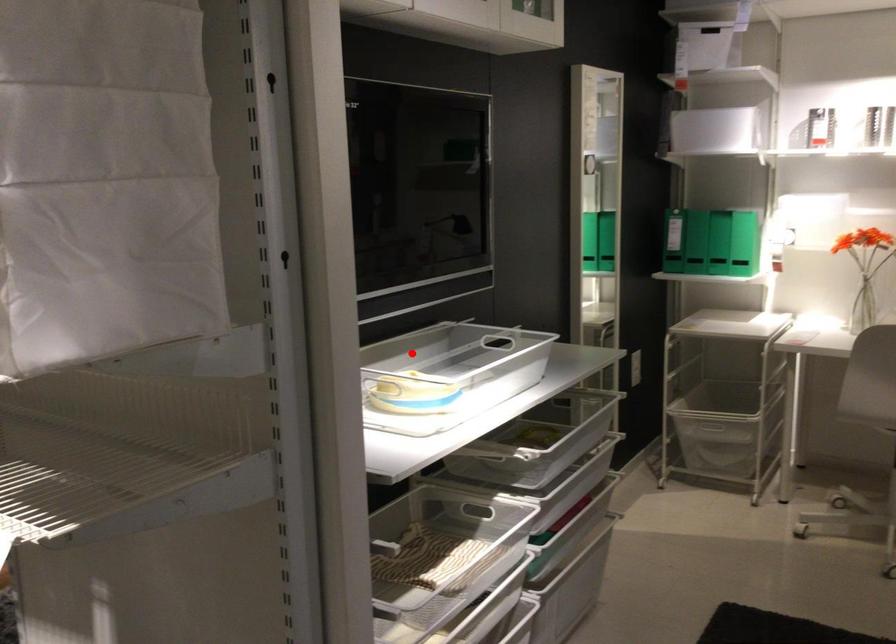
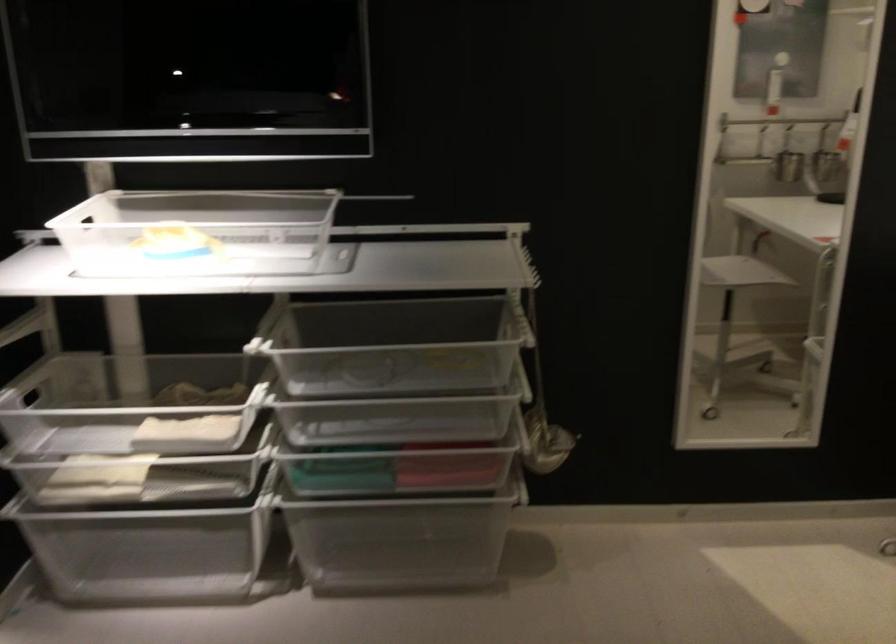
Question: A red point is marked in image1. In image2, is the corresponding 3D point closer to the camera or farther? Reply with the corresponding letter.

Choices:
 (A) The corresponding 3D point is closer.
 (B) The corresponding 3D point is farther.

Answer: (A)